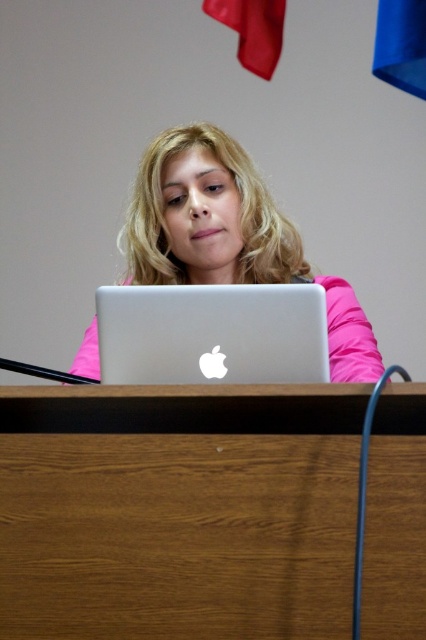
You are organizing a small event and need to place a rectangular box that is 15 cm thick on the brown wood table at center. Considering the table and laptop, will the box fit on the table without overlapping the matte silver laptop at center?

The brown wood table at center is thinner than the matte silver laptop at center. Since the box is 15 cm thick and the table is thinner than the laptop, it is likely that the table cannot accommodate the box without overlapping the laptop.

You are a furniture designer analyzing the desk setup. The brown wood table at center and the matte silver laptop at center are part of your study. Based on their positions, which object is closer to the floor?

The brown wood table at center is closer to the floor because it has a lesser height compared to the matte silver laptop at center.

You are a delivery person who needs to place a 8 inch wide package on the desk without moving any existing items. Is there enough space between the brown wood table at center and the silver metallic laptop at center to fit the package?

The brown wood table at center and silver metallic laptop at center are 7.28 inches apart from each other, which is less than the 8 inch width of the package. Therefore, there is not enough space to place the package between them without moving existing items.